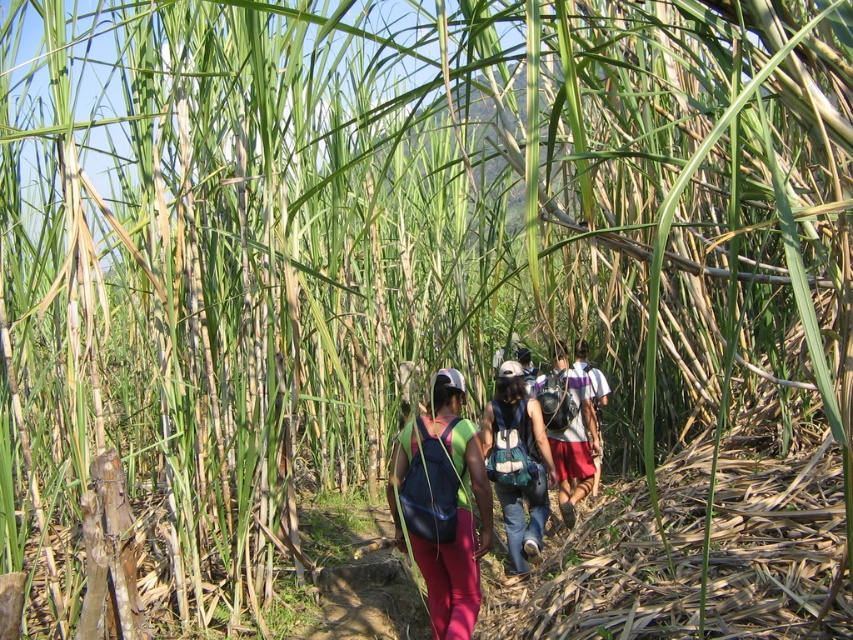
You are a photographer aiming to capture a clear shot of both the white cotton shirt at center and the matte purple backpack at center in the sugarcane field. Since the sugarcane stalks are tall and dense, you need to adjust your camera angle to ensure both objects are fully visible. Which object should you focus on first to frame the shot properly?

The white cotton shirt at center is taller than the matte purple backpack at center. To frame the shot properly, focus on the white cotton shirt at center first to ensure it doesn not get obscured by the tall sugarcane stalks, then adjust the angle to include the matte purple backpack at center.